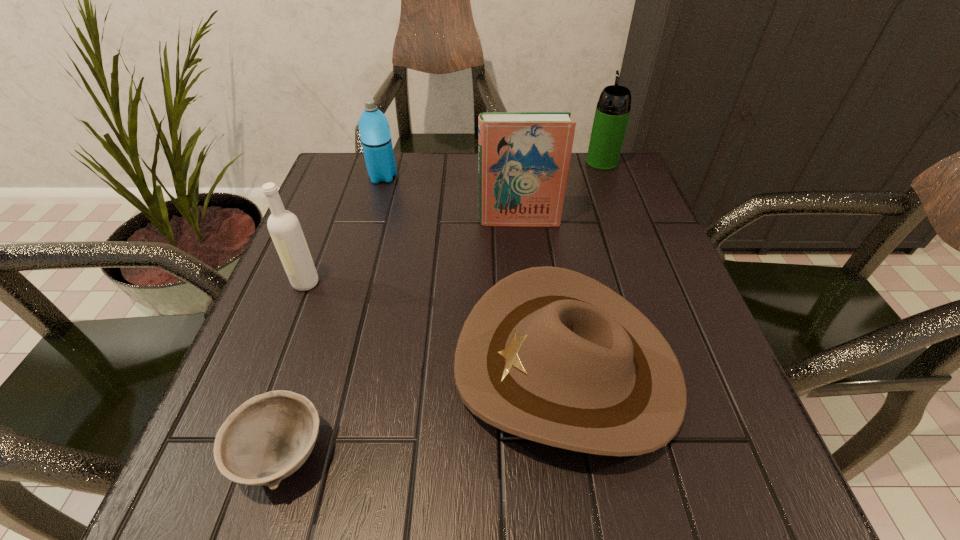
Where is `vacant space located 0.310m with a star on the front of the fifth tallest object`? This screenshot has width=960, height=540. vacant space located 0.310m with a star on the front of the fifth tallest object is located at coordinates (267, 367).

Where is `free location located 0.100m with a star on the front of the fifth tallest object`? This screenshot has height=540, width=960. free location located 0.100m with a star on the front of the fifth tallest object is located at coordinates (395, 367).

What are the coordinates of `blank space located 0.390m on the back of the bowl` in the screenshot? It's located at (349, 244).

Identify the location of cowboy hat that is at the near edge. This screenshot has width=960, height=540. (548, 354).

Where is `bowl that is at the near edge`? bowl that is at the near edge is located at coordinates (270, 436).

Locate an element on the screen. This screenshot has height=540, width=960. vodka that is at the left edge is located at coordinates (285, 230).

In order to click on thermos bottle that is at the left edge in this screenshot , I will do `click(375, 135)`.

Find the location of a particular element. bowl situated at the left edge is located at coordinates (270, 436).

You are a GUI agent. You are given a task and a screenshot of the screen. Output one action in this format:
    pyautogui.click(x=<x>, y=<y>)
    Task: Click on the thermos bottle located at the right edge
    
    Given the screenshot: What is the action you would take?
    pyautogui.click(x=612, y=112)

Where is `cowboy hat that is at the right edge`? cowboy hat that is at the right edge is located at coordinates (548, 354).